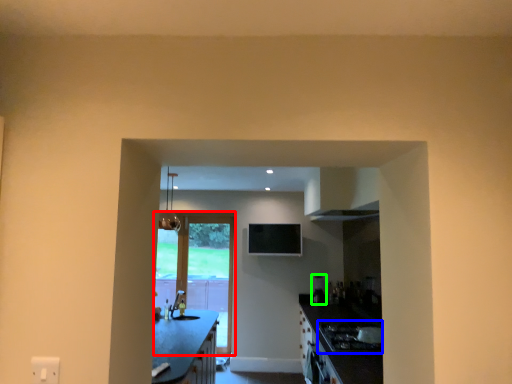
Question: Estimate the real-world distances between objects in this image. Which object is farther from door (highlighted by a red box), gas stove (highlighted by a blue box) or appliance (highlighted by a green box)?

Choices:
 (A) gas stove
 (B) appliance

Answer: (A)